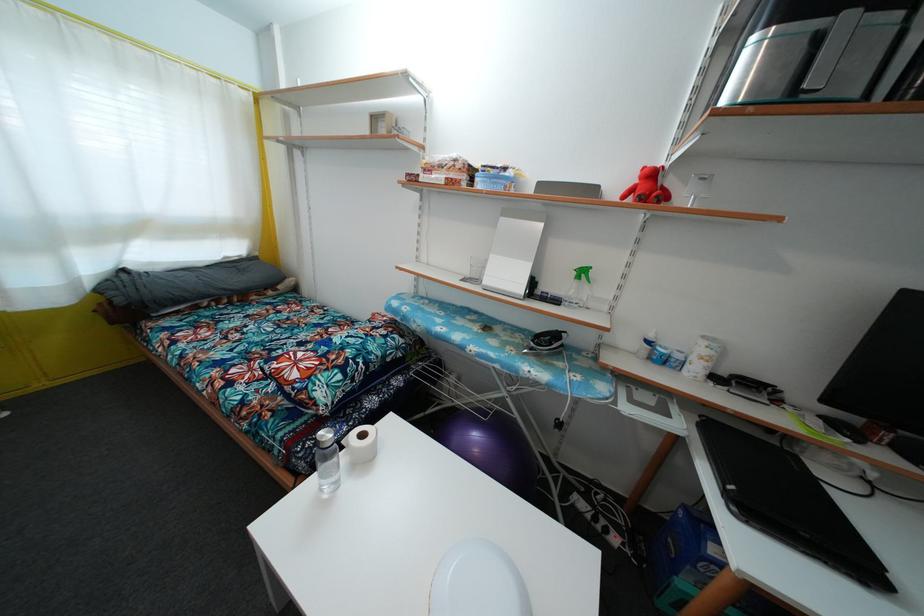
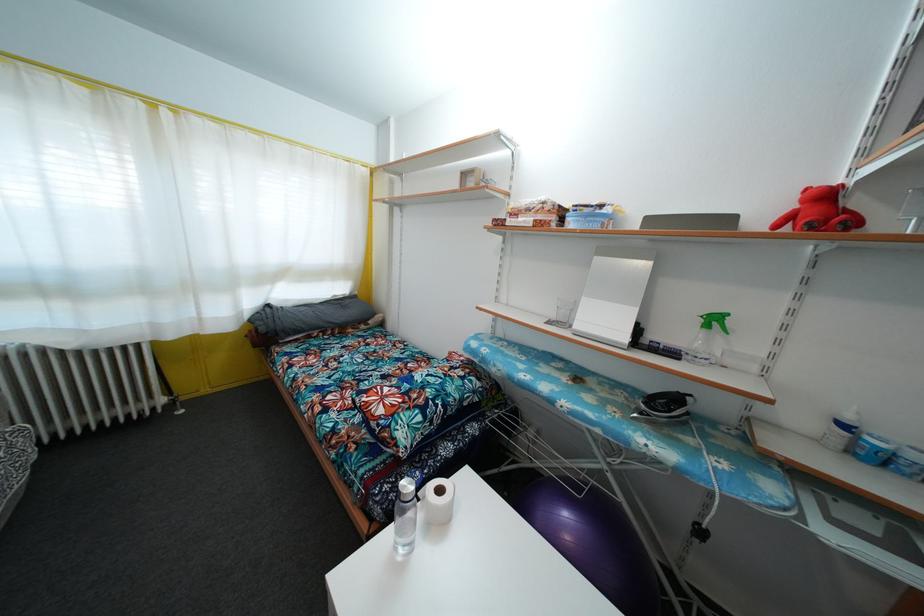
In the second image, find the point that corresponds to point 640,188 in the first image.

(800, 213)